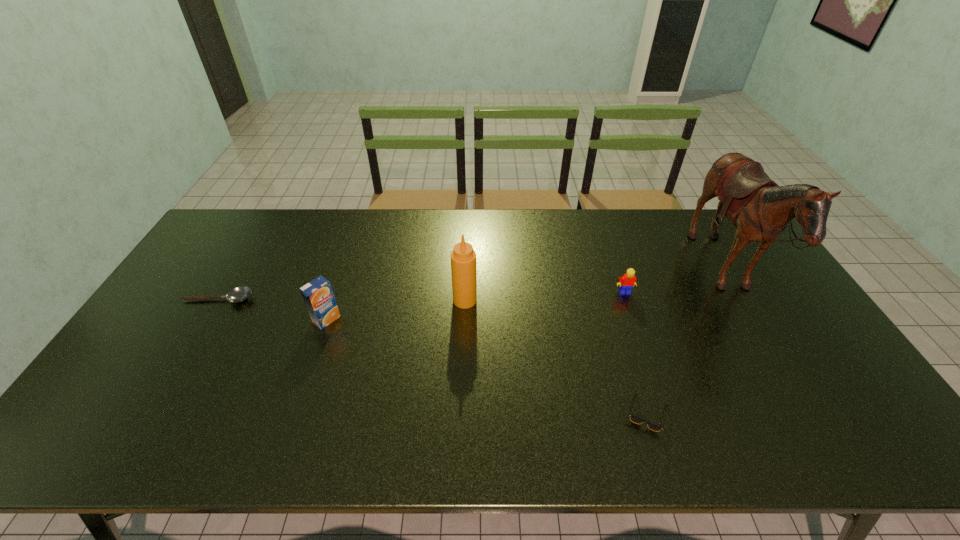
At what (x,y) coordinates should I click in order to perform the action: click on the shortest object. Please return your answer as a coordinate pair (x, y). This screenshot has width=960, height=540. Looking at the image, I should click on (238, 294).

This screenshot has width=960, height=540. Identify the location of free spot located 0.280m on the back of the saddle. (616, 274).

The image size is (960, 540). What are the coordinates of `vacant region located 0.400m on the back of the saddle` in the screenshot? It's located at (579, 274).

The image size is (960, 540). Identify the location of blank area located 0.110m on the back of the saddle. (669, 274).

At what (x,y) coordinates should I click in order to perform the action: click on vacant region located 0.380m on the right of the fifth shortest object. Please return your answer as a coordinate pair (x, y). Image resolution: width=960 pixels, height=540 pixels. Looking at the image, I should click on (602, 300).

Where is `free space located on the right of the orange_juice`? The width and height of the screenshot is (960, 540). free space located on the right of the orange_juice is located at coordinates (426, 320).

This screenshot has height=540, width=960. Identify the location of blank area located 0.050m on the front-facing side of the fourth tallest object. (630, 307).

In order to click on blank area located on the front of the shortest object in this screenshot , I will do `click(202, 325)`.

Identify the location of object that is at the far edge. The height and width of the screenshot is (540, 960). (760, 209).

Find the location of a particular element. Image resolution: width=960 pixels, height=540 pixels. object at the near edge is located at coordinates (635, 419).